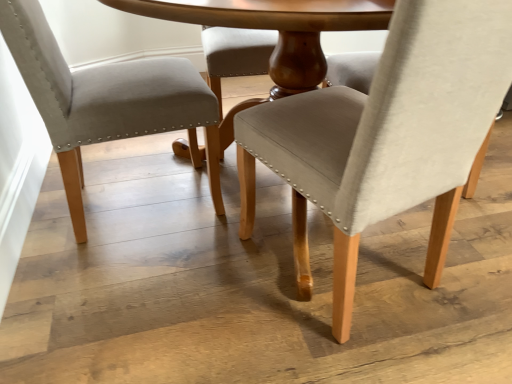
Locate an element on the screen. The height and width of the screenshot is (384, 512). free area below matte beige fabric chair at center, which is counted as the 2th chair, starting from the left (from a real-world perspective) is located at coordinates (358, 257).